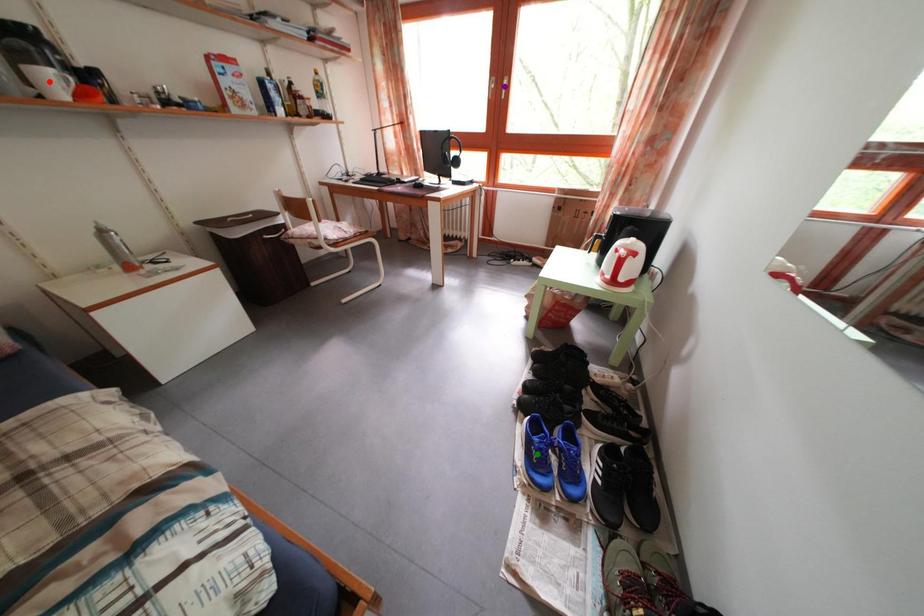
Order these from nearest to farthest:
1. purple point
2. green point
3. red point

red point
green point
purple point